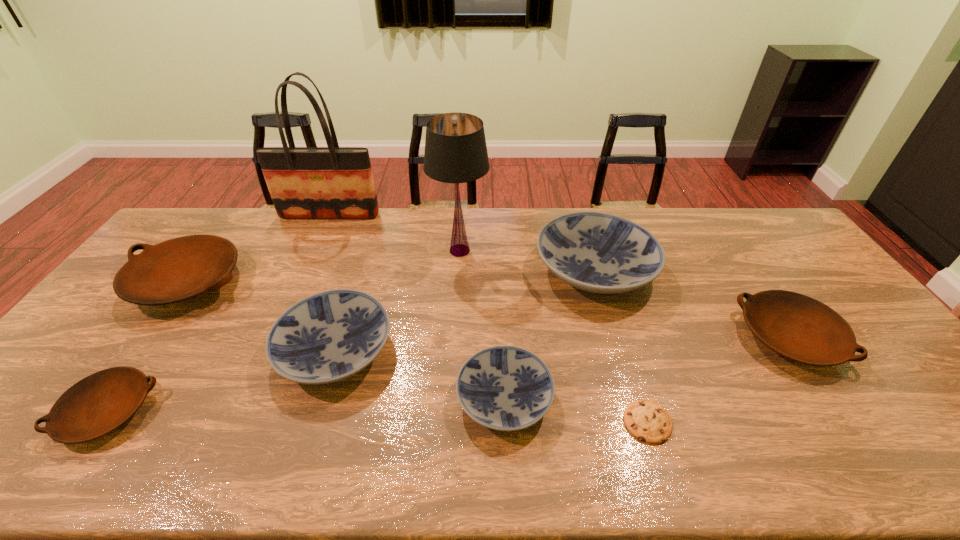
The width and height of the screenshot is (960, 540). I want to click on vacant space located on the right of the smallest blue plate, so 691,399.

Find the location of `free space located 0.090m on the back of the shortest plate`. free space located 0.090m on the back of the shortest plate is located at coordinates (153, 349).

Where is `vacant region located 0.370m on the back of the shortest object`? The height and width of the screenshot is (540, 960). vacant region located 0.370m on the back of the shortest object is located at coordinates (608, 295).

This screenshot has height=540, width=960. Identify the location of shopping bag that is at the far edge. (332, 182).

The image size is (960, 540). Find the location of `lampshade located in the far edge section of the desktop`. lampshade located in the far edge section of the desktop is located at coordinates point(455,151).

The width and height of the screenshot is (960, 540). Identify the location of plate present at the far edge. (596, 252).

Where is `cookie that is at the near edge`? This screenshot has height=540, width=960. cookie that is at the near edge is located at coordinates [646, 420].

Find the location of a particular element. This screenshot has height=540, width=960. object that is at the right edge is located at coordinates 800,328.

Where is `object located in the near left corner section of the desktop`? The image size is (960, 540). object located in the near left corner section of the desktop is located at coordinates (100, 403).

Identify the location of vacant point at the far edge. This screenshot has height=540, width=960. pos(323,245).